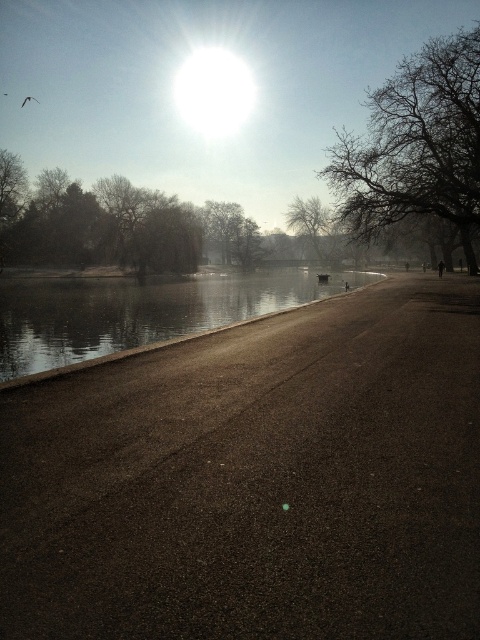
You are a photographer wanting to capture a shot of the smooth concrete river at center without the bare branches at upper right appearing in the frame. Based on their positions, which direction should you move your camera to the left or right?

The bare branches at upper right is to the right of smooth concrete river at center, so moving the camera to the left would position the branches out of the frame while keeping the river centered.

You are a photographer setting up a tripod in the park. You want to capture the reflection of the bare branches at upper right and the green leafy tree at upper left in the water. Which object will have a larger reflection in the water?

The bare branches at upper right will have a larger reflection in the water because it is bigger than the green leafy tree at upper left.